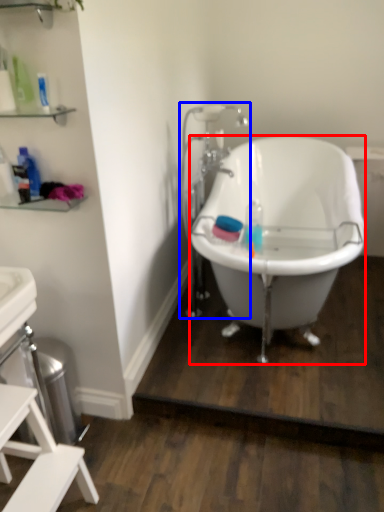
Question: Among these objects, which one is nearest to the camera, bathtub (highlighted by a red box) or faucet (highlighted by a blue box)?

Choices:
 (A) bathtub
 (B) faucet

Answer: (A)